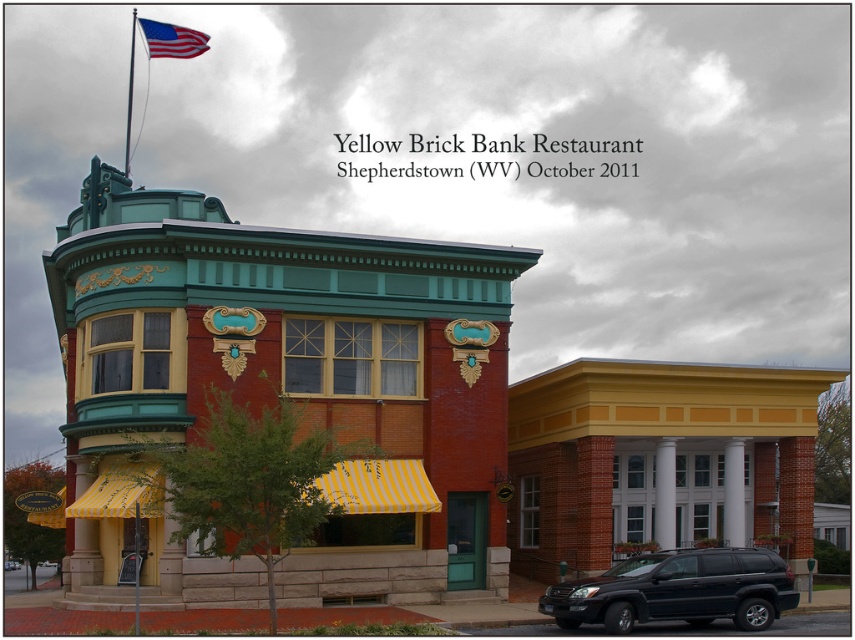
You are standing in front of the Yellow Brick Bank Restaurant and notice the american flag at top left and the metallic flag pole at upper left. Which object is smaller in size?

The american flag at top left is smaller in size compared to the metallic flag pole at upper left.

You are a photographer standing in front of the Yellow Brick Bank Restaurant. You want to capture a shot that includes both the black matte suv at lower right and the metallic flag pole at upper left. Which object should you position closer to the right side of your camera frame?

The black matte suv at lower right should be positioned closer to the right side of your camera frame since it is already on the right side of the metallic flag pole at upper left.